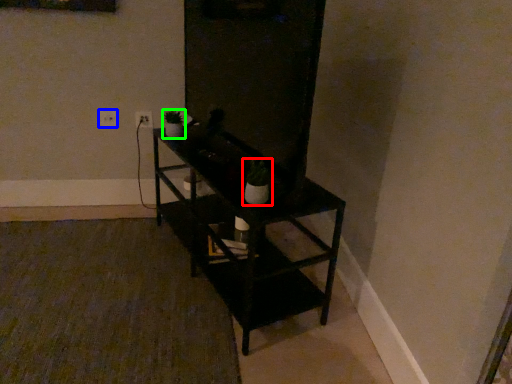
Question: Which object is the farthest from houseplant (highlighted by a red box)? Choose among these: electric outlet (highlighted by a blue box) or houseplant (highlighted by a green box).

Choices:
 (A) electric outlet
 (B) houseplant

Answer: (A)